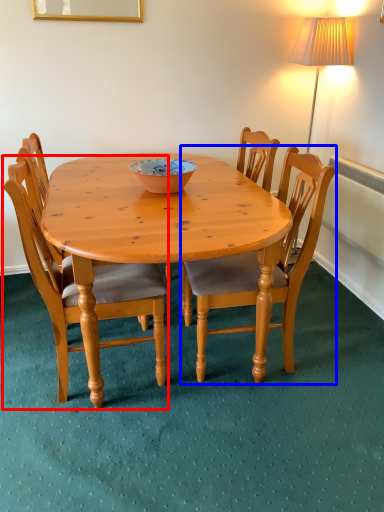
Question: Which point is closer to the camera, chair (highlighted by a red box) or chair (highlighted by a blue box)?

Choices:
 (A) chair
 (B) chair

Answer: (A)